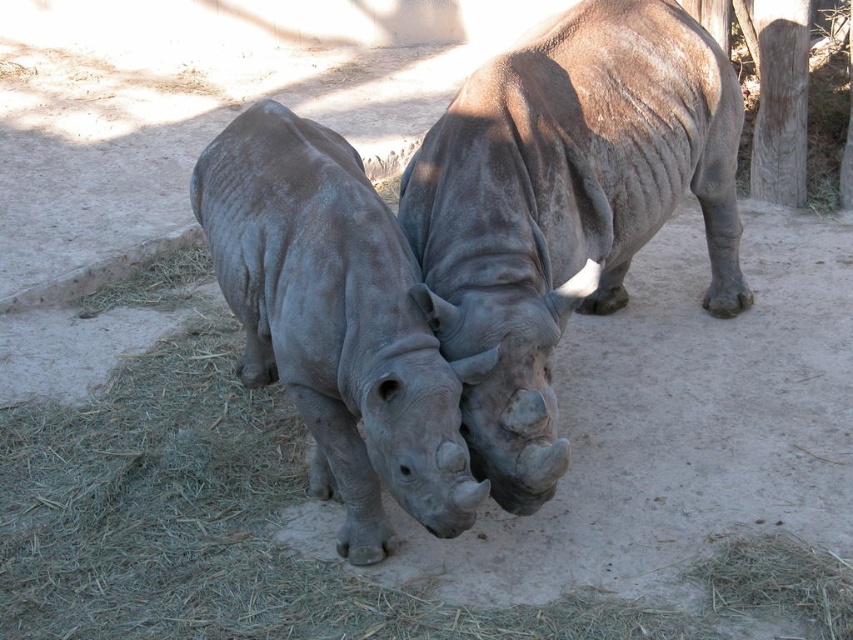
Question: Is gray textured rhino at center further to camera compared to gray matte rhinoceros at center?

Choices:
 (A) yes
 (B) no

Answer: (A)

Question: Does gray textured rhino at center appear on the left side of gray matte rhinoceros at center?

Choices:
 (A) yes
 (B) no

Answer: (B)

Question: In this image, where is gray textured rhino at center located relative to gray matte rhinoceros at center?

Choices:
 (A) above
 (B) below

Answer: (A)

Question: Which point is closer to the camera?

Choices:
 (A) gray matte rhinoceros at center
 (B) gray textured rhino at center

Answer: (A)

Question: Which object appears closest to the camera in this image?

Choices:
 (A) gray textured rhino at center
 (B) gray matte rhinoceros at center

Answer: (B)